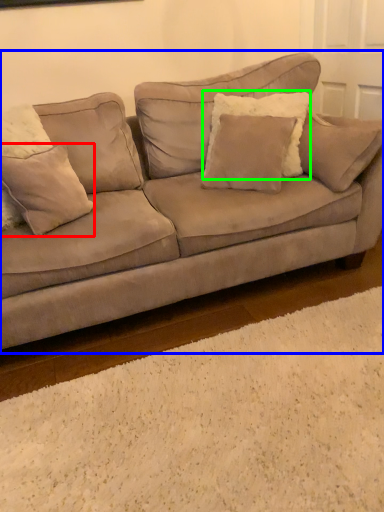
Question: Which object is the farthest from pillow (highlighted by a red box)? Choose among these: studio couch (highlighted by a blue box) or pillow (highlighted by a green box).

Choices:
 (A) studio couch
 (B) pillow

Answer: (B)